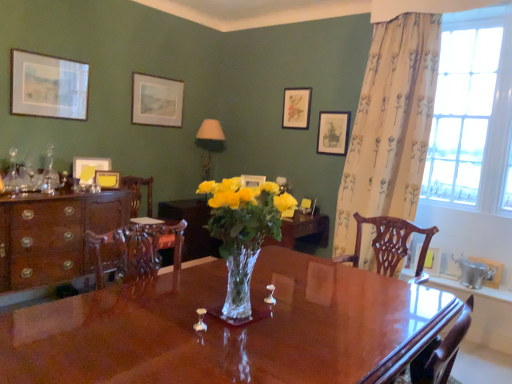
Image resolution: width=512 pixels, height=384 pixels. I want to click on space that is in front of wooden picture frame at right, the 2th picture frame viewed from the right, so click(437, 281).